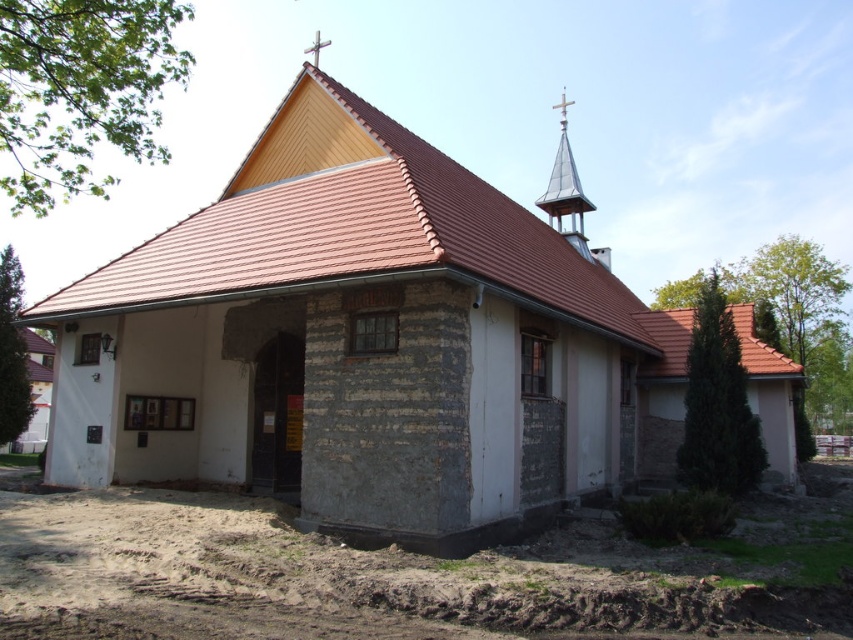
Question: Considering the relative positions of brown soil at lower left and shiny silver spire at upper right in the image provided, where is brown soil at lower left located with respect to shiny silver spire at upper right?

Choices:
 (A) above
 (B) below

Answer: (B)

Question: Which object is farther from the camera taking this photo?

Choices:
 (A) shiny silver spire at upper right
 (B) brown soil at lower left

Answer: (A)

Question: Among these points, which one is nearest to the camera?

Choices:
 (A) (589, 252)
 (B) (474, 616)

Answer: (B)

Question: Is brown soil at lower left above shiny silver spire at upper right?

Choices:
 (A) no
 (B) yes

Answer: (A)

Question: From the image, what is the correct spatial relationship of brown soil at lower left in relation to shiny silver spire at upper right?

Choices:
 (A) right
 (B) left

Answer: (B)